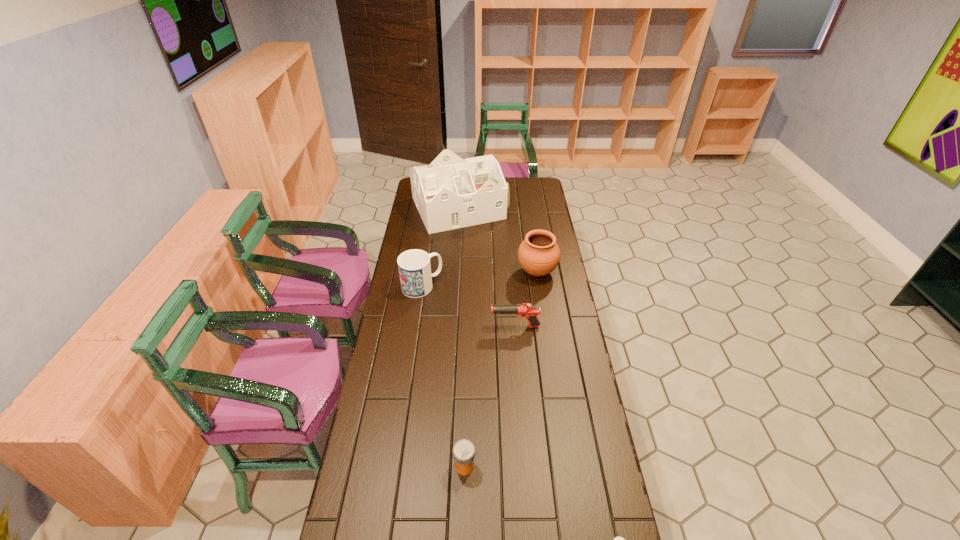
I want to click on object located at the far left corner, so click(x=450, y=193).

At what (x,y) coordinates should I click in order to perform the action: click on vacant space at the left edge of the desktop. Please return your answer as a coordinate pair (x, y). This screenshot has height=540, width=960. Looking at the image, I should click on (427, 248).

Find the location of `vacant position at the right edge of the desktop`. vacant position at the right edge of the desktop is located at coordinates (590, 442).

I want to click on vacant space at the far right corner of the desktop, so click(x=526, y=179).

This screenshot has width=960, height=540. I want to click on free space between the farther medicine and the gun, so click(x=490, y=396).

Locate an element on the screen. The height and width of the screenshot is (540, 960). free space between the fourth tallest object and the farther medicine is located at coordinates (490, 396).

This screenshot has height=540, width=960. Find the location of `free area in between the fifth farthest object and the farthest object`. free area in between the fifth farthest object and the farthest object is located at coordinates (462, 337).

Where is `unoccupied position between the dollhouse and the farther medicine`? This screenshot has height=540, width=960. unoccupied position between the dollhouse and the farther medicine is located at coordinates (462, 337).

Where is `free area in between the fifth shortest object and the fifth farthest object`? This screenshot has width=960, height=540. free area in between the fifth shortest object and the fifth farthest object is located at coordinates (501, 369).

The width and height of the screenshot is (960, 540). I want to click on free space between the dollhouse and the farther medicine, so click(462, 337).